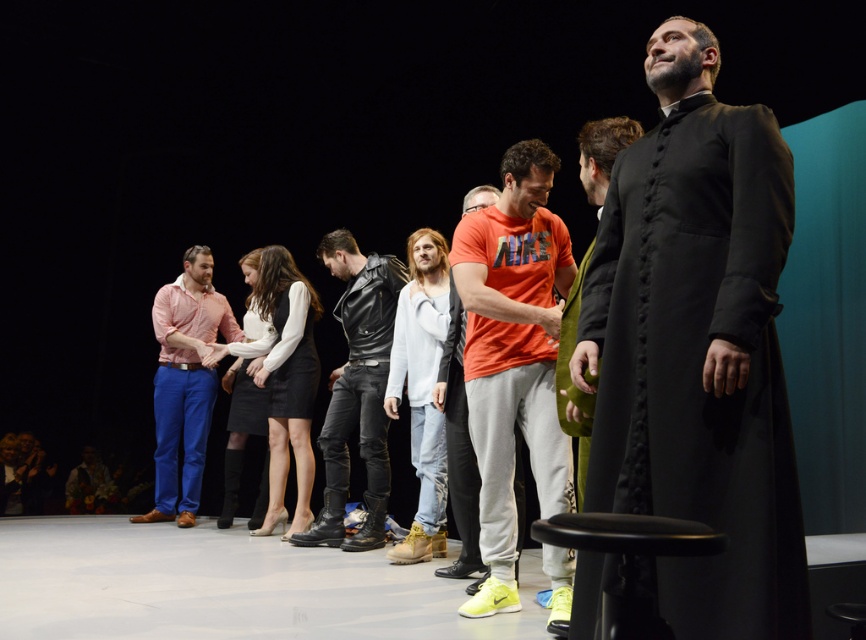
Question: Is black matte robe at center wider than matte pink shirt at center?

Choices:
 (A) yes
 (B) no

Answer: (B)

Question: Estimate the real-world distances between objects in this image. Which object is farther from the black matte robe at center?

Choices:
 (A) orange matte t-shirt at center
 (B) leather jacket at center
 (C) orange cotton t-shirt at center

Answer: (B)

Question: Can you confirm if leather jacket at center is positioned to the left of orange matte t-shirt at center?

Choices:
 (A) no
 (B) yes

Answer: (B)

Question: Observing the image, what is the correct spatial positioning of black matte robe at center in reference to white cotton shirt at center?

Choices:
 (A) right
 (B) left

Answer: (A)

Question: Considering the real-world distances, which object is closest to the black matte robe at center?

Choices:
 (A) white cotton shirt at center
 (B) matte pink shirt at center
 (C) orange cotton t-shirt at center
 (D) leather jacket at center

Answer: (C)

Question: Which of the following is the closest to the observer?

Choices:
 (A) (474, 512)
 (B) (507, 285)
 (C) (625, 273)

Answer: (C)